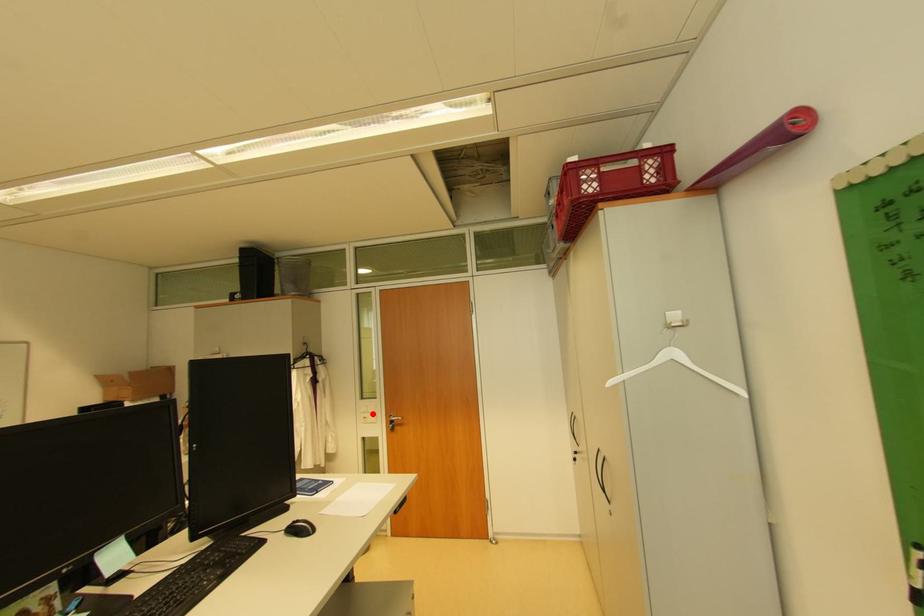
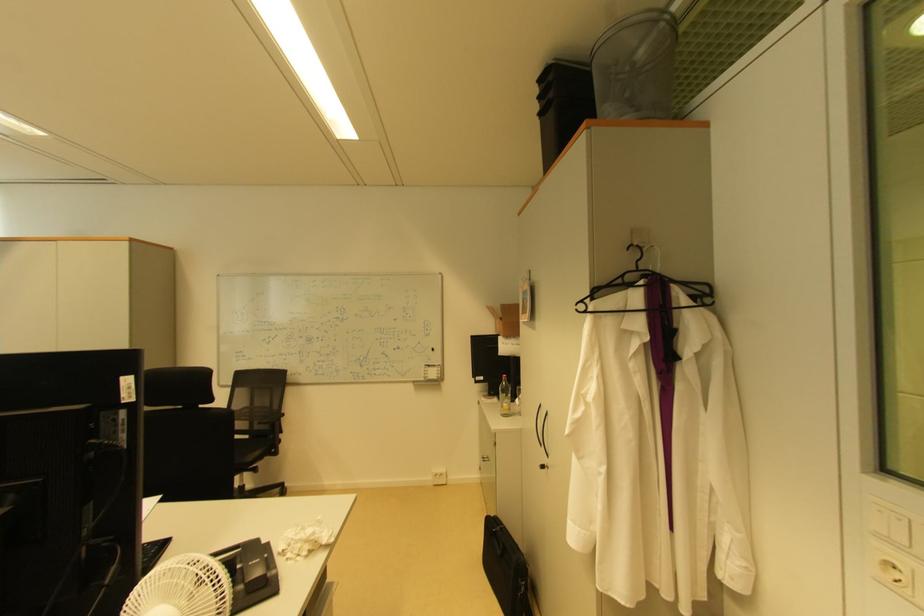
Find the pixel in the second image that matches the highlighted location in the first image.

(894, 541)